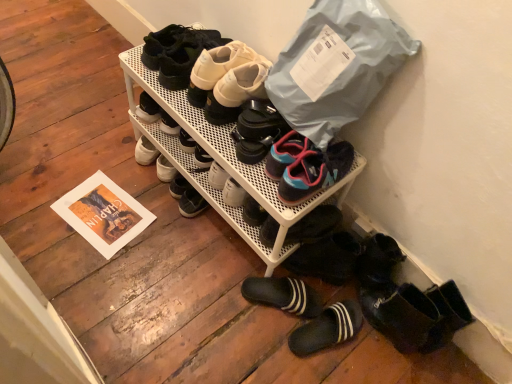
This screenshot has width=512, height=384. Identify the location of free spot to the right of black rubber slippers at lower center, the 1th footwear in the bottom-to-top sequence. (369, 355).